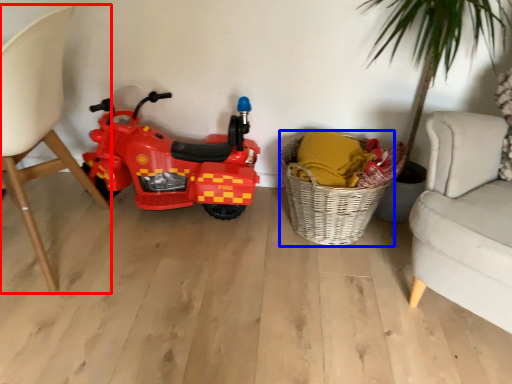
Question: Which of the following is the closest to the observer, chair (highlighted by a red box) or basket (highlighted by a blue box)?

Choices:
 (A) chair
 (B) basket

Answer: (A)